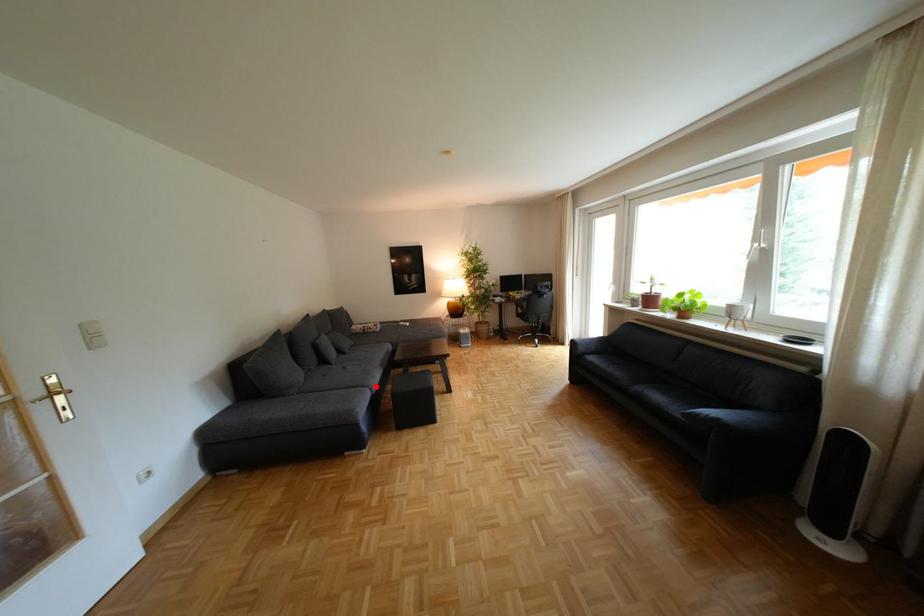
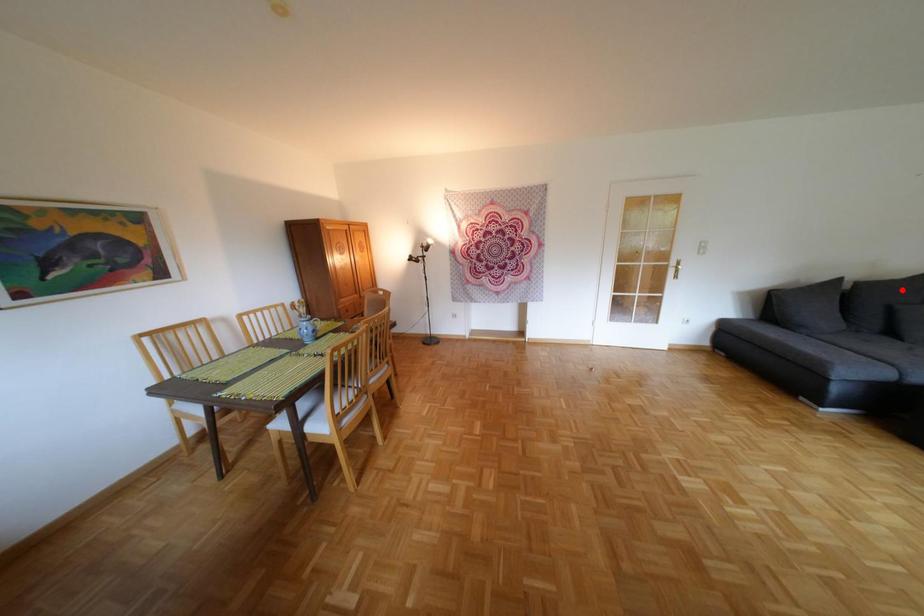
I am providing you with two images of the same scene from different viewpoints. A red point is marked on the first image and another point is marked on the second image. Do the highlighted points in image1 and image2 indicate the same real-world spot?

No